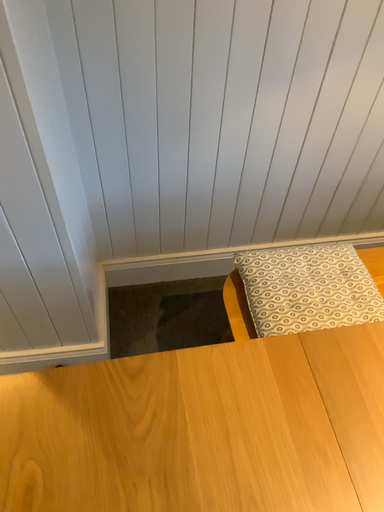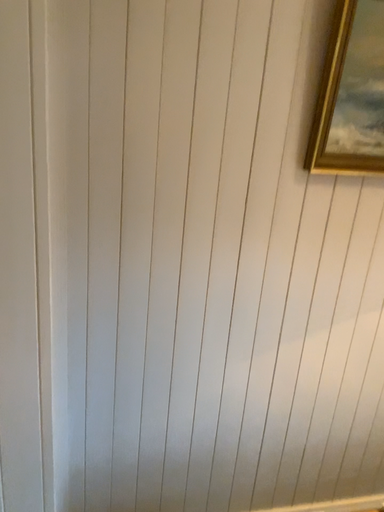
Question: Which way did the camera rotate in the video?

Choices:
 (A) rotated downward
 (B) rotated upward

Answer: (B)